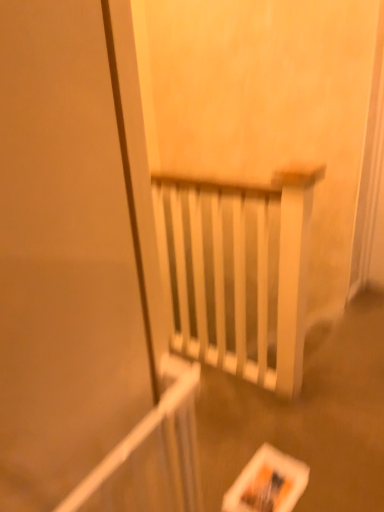
This screenshot has width=384, height=512. Describe the element at coordinates (151, 455) in the screenshot. I see `white matte balustrade at center` at that location.

Identify the location of white matte balustrade at center. (151, 455).

I want to click on white matte balustrade at center, so click(151, 455).